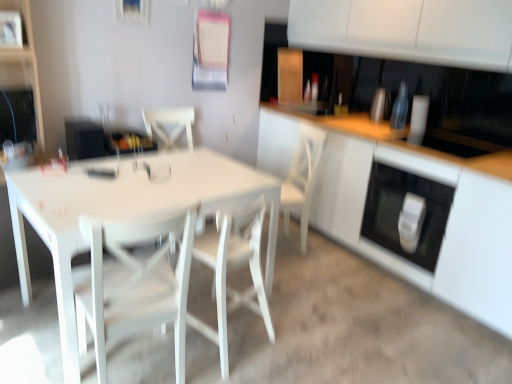
Question: Does white wood chair at center, acting as the 2th chair starting from the left, touch white wood chair at center?

Choices:
 (A) yes
 (B) no

Answer: (B)

Question: Is white wood chair at center, acting as the 2th chair starting from the left, taller than white wood chair at center?

Choices:
 (A) no
 (B) yes

Answer: (A)

Question: From a real-world perspective, is white wood chair at center, the 1th chair from the right, positioned over white wood chair at center based on gravity?

Choices:
 (A) no
 (B) yes

Answer: (A)

Question: Can you confirm if white wood chair at center, the 1th chair from the right, is positioned to the right of white wood chair at center?

Choices:
 (A) yes
 (B) no

Answer: (B)

Question: Can you confirm if white wood chair at center, the 1th chair from the right, is wider than white wood chair at center?

Choices:
 (A) yes
 (B) no

Answer: (B)

Question: Would you say white glossy cabinet at center is to the left or to the right of white wood chair at center, acting as the 2th chair starting from the left, in the picture?

Choices:
 (A) right
 (B) left

Answer: (A)

Question: Is white glossy cabinet at center inside or outside of white wood chair at center, acting as the 2th chair starting from the left?

Choices:
 (A) inside
 (B) outside

Answer: (B)

Question: From a real-world perspective, relative to white wood chair at center, the 1th chair from the right, is white glossy cabinet at center vertically above or below?

Choices:
 (A) below
 (B) above

Answer: (B)

Question: In terms of height, does white glossy cabinet at center look taller or shorter compared to white wood chair at center, the 1th chair from the right?

Choices:
 (A) tall
 (B) short

Answer: (A)

Question: Is white glossy shelf at upper left inside the boundaries of white glossy soap dispenser at lower right, or outside?

Choices:
 (A) outside
 (B) inside

Answer: (A)

Question: Is white glossy shelf at upper left to the left or to the right of white glossy soap dispenser at lower right in the image?

Choices:
 (A) left
 (B) right

Answer: (A)

Question: Considering their positions, is white glossy shelf at upper left located in front of or behind white glossy soap dispenser at lower right?

Choices:
 (A) front
 (B) behind

Answer: (A)

Question: Does point (1, 54) appear closer or farther from the camera than point (415, 243)?

Choices:
 (A) closer
 (B) farther

Answer: (A)

Question: Looking at the image, does white wood chair at center, acting as the 2th chair starting from the left, seem bigger or smaller compared to white wood chair at center?

Choices:
 (A) big
 (B) small

Answer: (B)

Question: Is white wood chair at center, the 1th chair from the right, inside or outside of white wood chair at center?

Choices:
 (A) outside
 (B) inside

Answer: (A)